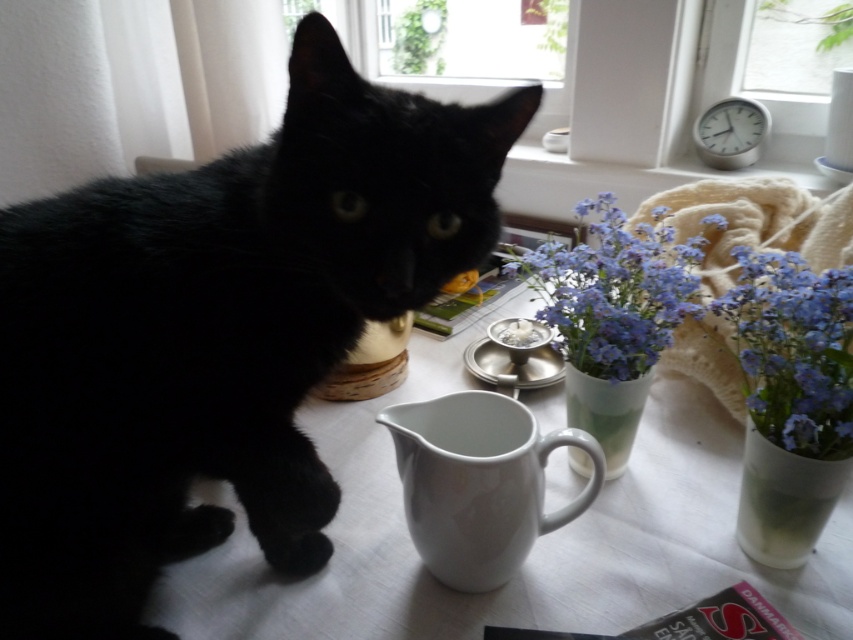
Question: Which object is farther from the camera taking this photo?

Choices:
 (A) white ceramic mug at lower center
 (B) matte ceramic vase at upper right
 (C) black fur cat at left

Answer: (A)

Question: Estimate the real-world distances between objects in this image. Which object is closer to the black fur cat at left?

Choices:
 (A) white ceramic mug at lower center
 (B) transparent glass window at upper center

Answer: (A)

Question: Is blue matte vase at center smaller than blue matte vase at center right?

Choices:
 (A) yes
 (B) no

Answer: (B)

Question: Which point is farther to the camera?

Choices:
 (A) transparent glass window at upper center
 (B) white glossy table at center
 (C) matte ceramic vase at upper right
 (D) black fur cat at left

Answer: (A)

Question: Can you confirm if white glossy table at center is wider than matte ceramic vase at upper right?

Choices:
 (A) yes
 (B) no

Answer: (A)

Question: Does white ceramic mug at lower center lie behind blue matte vase at center right?

Choices:
 (A) yes
 (B) no

Answer: (A)